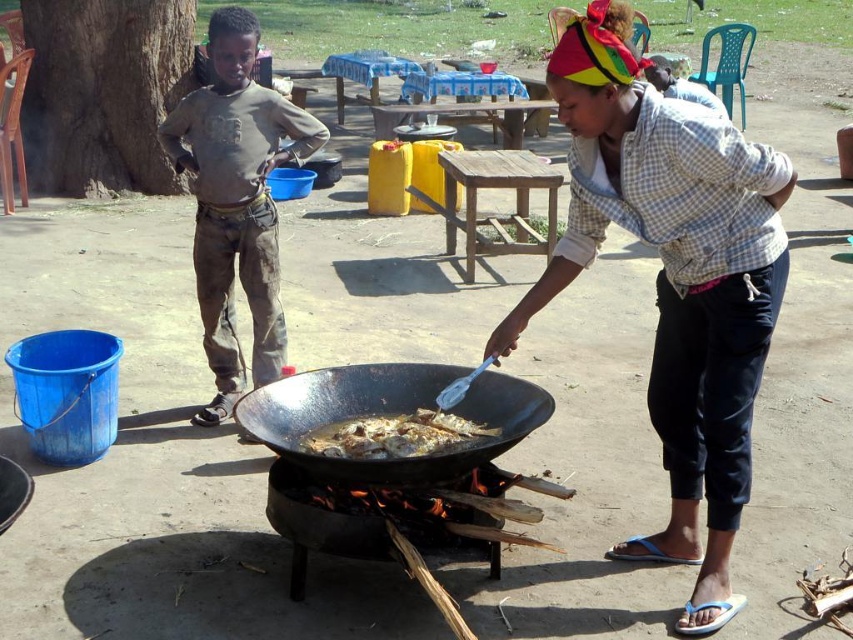
Identify the location of brown cotton pants at left. (236, 202).

Identify the location of brown cotton pants at left. (236, 202).

Where is `brown cotton pants at left`? brown cotton pants at left is located at coordinates (236, 202).

Between brown cotton pants at left and golden brown crispy fish at center, which one has less height?

golden brown crispy fish at center

Which is behind, point (190, 161) or point (352, 448)?

The point (190, 161) is behind.

Between point (209, 292) and point (357, 452), which one is positioned behind?

Positioned behind is point (209, 292).

You are a GUI agent. You are given a task and a screenshot of the screen. Output one action in this format:
    pyautogui.click(x=<x>, y=<y>)
    Task: Click on the brown cotton pants at left
    This screenshot has width=853, height=640.
    Given the screenshot: What is the action you would take?
    pyautogui.click(x=236, y=202)

Does black matte wok at center appear over golden brown crispy fish at center?

Yes.

Between black matte wok at center and golden brown crispy fish at center, which one appears on the right side from the viewer's perspective?

Positioned to the right is golden brown crispy fish at center.

Who is more distant from viewer, (279,451) or (393,436)?

Point (393,436)

At what (x,y) coordinates should I click in order to perform the action: click on black matte wok at center. Please return your answer as a coordinate pair (x, y). This screenshot has width=853, height=640. Looking at the image, I should click on (387, 413).